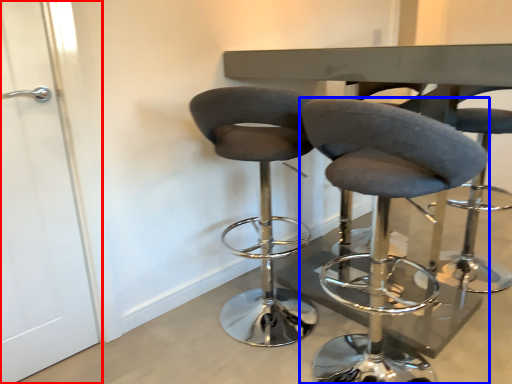
Question: Which object is further to the camera taking this photo, screen door (highlighted by a red box) or chair (highlighted by a blue box)?

Choices:
 (A) screen door
 (B) chair

Answer: (A)